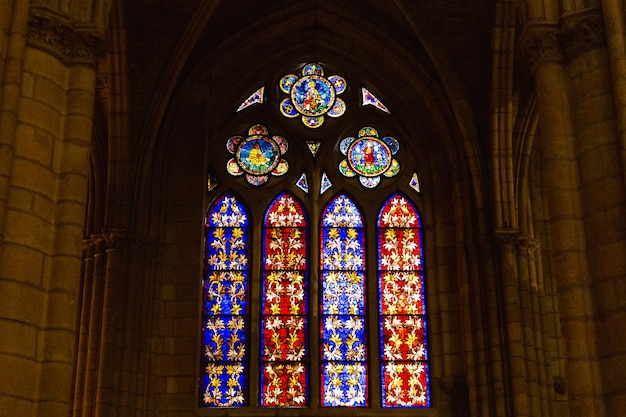
Locate an element on the screen. blue long window sections is located at coordinates (342, 202), (344, 245), (344, 294), (344, 341), (345, 384), (231, 382), (228, 332), (228, 304), (233, 245), (225, 207).